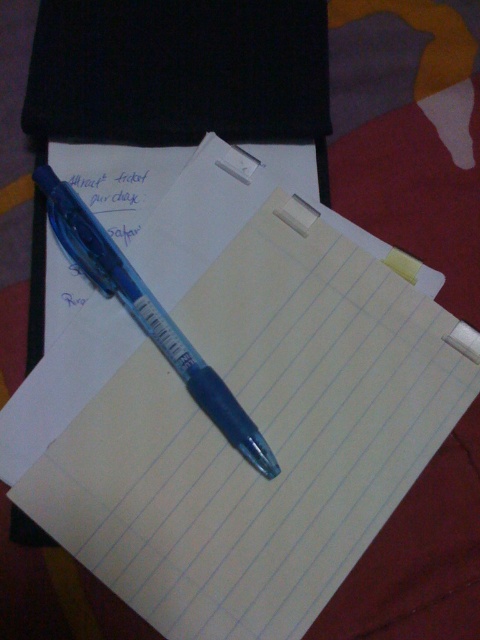
You are organizing your desk and need to place the transparent plastic pen at center into a drawer. The drawer has a slot that is 0.3 meters wide. Is the pen narrower than the slot?

The transparent plastic pen at center is located at point [148,316], which indicates its position but does not provide information about its width. Therefore, it is impossible to determine if it is narrower than the 0.3 meters wide slot based on the given description.

What object is located at the coordinates point (148,316) in the workspace setup?

The point (148,316) marks the transparent plastic pen at center.

Based on the photo, you are looking at the workspace setup and notice two points marked on the image. Which point is closer to you, point (307, 220) or point (407, 266)?

Point (307, 220) is closer to you than point (407, 266).